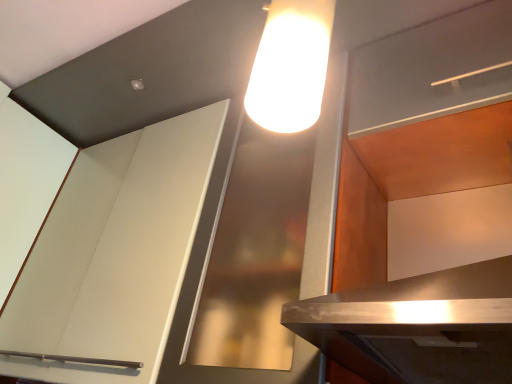
Question: Should I look upward or downward to see matte wood shelf at upper right?

Choices:
 (A) up
 (B) down

Answer: (A)

Question: Does matte white cabinet at upper right, which is counted as the second cabinetry, starting from the left, have a greater width compared to matte wood shelf at upper right?

Choices:
 (A) yes
 (B) no

Answer: (A)

Question: Could you tell me if matte white cabinet at upper right, which is counted as the second cabinetry, starting from the left, is turned towards matte wood shelf at upper right?

Choices:
 (A) no
 (B) yes

Answer: (A)

Question: Is matte white cabinet at upper right, which ranks as the first cabinetry in right-to-left order, positioned beyond the bounds of matte wood shelf at upper right?

Choices:
 (A) no
 (B) yes

Answer: (B)

Question: Is matte white cabinet at upper right, which is counted as the second cabinetry, starting from the left, facing away from matte wood shelf at upper right?

Choices:
 (A) yes
 (B) no

Answer: (B)

Question: Is matte wood shelf at upper right a part of matte white cabinet at upper right, which ranks as the first cabinetry in right-to-left order?

Choices:
 (A) yes
 (B) no

Answer: (B)

Question: From the image's perspective, is matte white cabinet at upper right, which is counted as the second cabinetry, starting from the left, located beneath matte wood shelf at upper right?

Choices:
 (A) yes
 (B) no

Answer: (A)

Question: From a real-world perspective, is matte wood shelf at upper right located higher than white matte cabinet at upper left, marked as the 1th cabinetry in a left-to-right arrangement?

Choices:
 (A) yes
 (B) no

Answer: (A)

Question: Can you confirm if matte wood shelf at upper right is shorter than white matte cabinet at upper left, arranged as the second cabinetry when viewed from the right?

Choices:
 (A) no
 (B) yes

Answer: (B)

Question: Is matte wood shelf at upper right located outside white matte cabinet at upper left, marked as the 1th cabinetry in a left-to-right arrangement?

Choices:
 (A) no
 (B) yes

Answer: (B)

Question: Considering the relative sizes of matte wood shelf at upper right and white matte cabinet at upper left, arranged as the second cabinetry when viewed from the right, in the image provided, is matte wood shelf at upper right smaller than white matte cabinet at upper left, arranged as the second cabinetry when viewed from the right,?

Choices:
 (A) yes
 (B) no

Answer: (A)

Question: Does matte wood shelf at upper right turn towards white matte cabinet at upper left, arranged as the second cabinetry when viewed from the right?

Choices:
 (A) yes
 (B) no

Answer: (B)

Question: Are matte wood shelf at upper right and white matte cabinet at upper left, arranged as the second cabinetry when viewed from the right, far apart?

Choices:
 (A) yes
 (B) no

Answer: (B)

Question: From a real-world perspective, is white matte cabinet at upper left, marked as the 1th cabinetry in a left-to-right arrangement, on top of matte wood shelf at upper right?

Choices:
 (A) no
 (B) yes

Answer: (A)